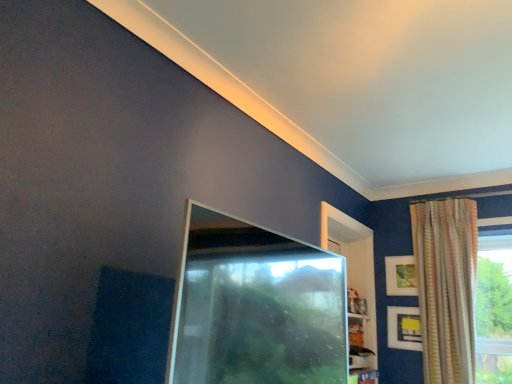
Question: Is matte gold picture frame at upper right, the 1th picture frame positioned from the top, wider than striped fabric curtain at upper right?

Choices:
 (A) yes
 (B) no

Answer: (B)

Question: Is there a large distance between matte gold picture frame at upper right, the 1th picture frame positioned from the top, and striped fabric curtain at upper right?

Choices:
 (A) yes
 (B) no

Answer: (B)

Question: Can you confirm if matte gold picture frame at upper right, which is counted as the 2th picture frame, starting from the bottom, is positioned to the right of striped fabric curtain at upper right?

Choices:
 (A) no
 (B) yes

Answer: (A)

Question: Is matte gold picture frame at upper right, which is counted as the 2th picture frame, starting from the bottom, shorter than striped fabric curtain at upper right?

Choices:
 (A) no
 (B) yes

Answer: (B)

Question: Does matte gold picture frame at upper right, which is counted as the 2th picture frame, starting from the bottom, lie behind striped fabric curtain at upper right?

Choices:
 (A) no
 (B) yes

Answer: (B)

Question: Considering the relative sizes of matte gold picture frame at upper right, the 1th picture frame positioned from the top, and striped fabric curtain at upper right in the image provided, is matte gold picture frame at upper right, the 1th picture frame positioned from the top, thinner than striped fabric curtain at upper right?

Choices:
 (A) yes
 (B) no

Answer: (A)

Question: From a real-world perspective, does transparent glass screen door at center sit lower than matte black picture frame at upper right, acting as the 2th picture frame starting from the top?

Choices:
 (A) no
 (B) yes

Answer: (B)

Question: Does transparent glass screen door at center have a larger size compared to matte black picture frame at upper right, acting as the 2th picture frame starting from the top?

Choices:
 (A) no
 (B) yes

Answer: (B)

Question: Is transparent glass screen door at center in front of matte black picture frame at upper right, acting as the 2th picture frame starting from the top?

Choices:
 (A) yes
 (B) no

Answer: (A)

Question: From the image's perspective, is transparent glass screen door at center below matte black picture frame at upper right, acting as the 2th picture frame starting from the top?

Choices:
 (A) yes
 (B) no

Answer: (B)

Question: Can you confirm if transparent glass screen door at center is wider than matte black picture frame at upper right, acting as the 2th picture frame starting from the top?

Choices:
 (A) yes
 (B) no

Answer: (A)

Question: Is transparent glass screen door at center positioned behind matte black picture frame at upper right, acting as the 2th picture frame starting from the top?

Choices:
 (A) yes
 (B) no

Answer: (B)

Question: From the image's perspective, is matte black picture frame at upper right, which is counted as the 1th picture frame, starting from the bottom, over transparent glass screen door at center?

Choices:
 (A) no
 (B) yes

Answer: (A)